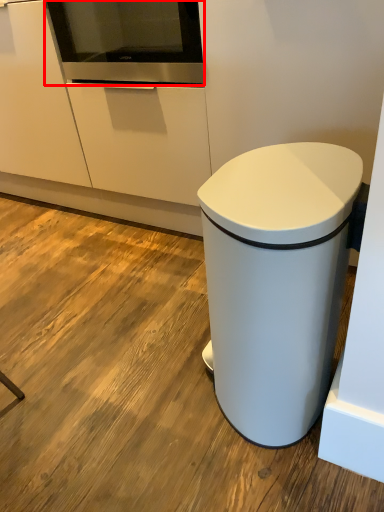
Question: Observing the image, what is the correct spatial positioning of home appliance (annotated by the red box) in reference to waste container?

Choices:
 (A) right
 (B) left

Answer: (B)